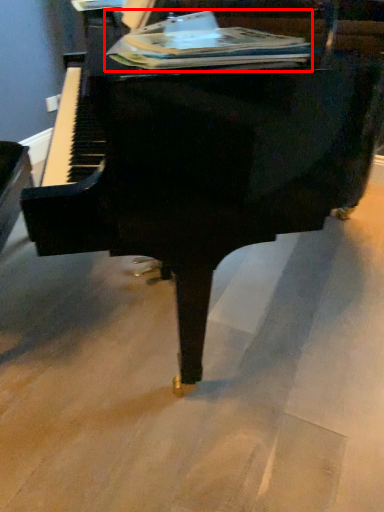
Question: In this image, where is paperback book (annotated by the red box) located relative to piano?

Choices:
 (A) right
 (B) left

Answer: (B)